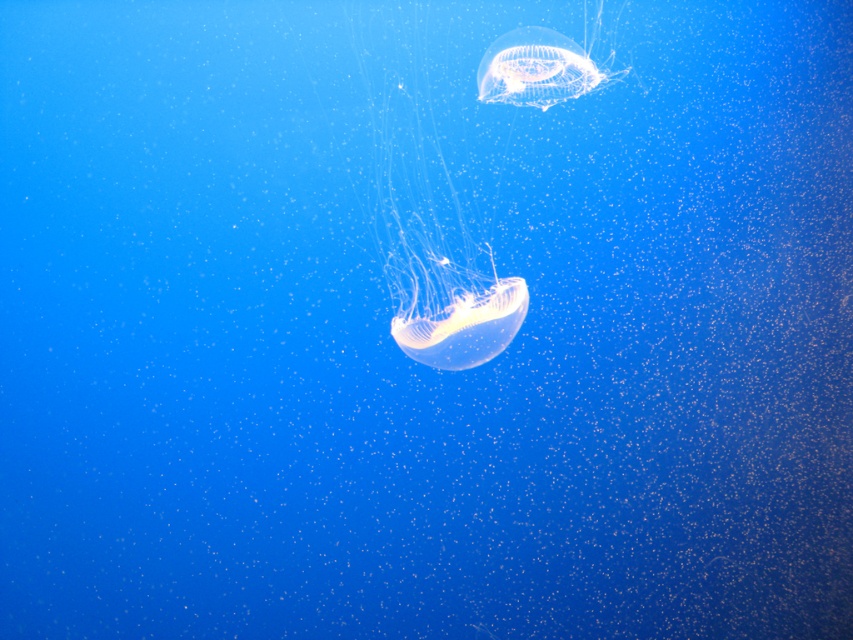
Question: Does translucent gelatinous at center have a larger size compared to transparent gelatinous at upper center?

Choices:
 (A) yes
 (B) no

Answer: (A)

Question: Can you confirm if translucent gelatinous at center is positioned to the left of transparent gelatinous at upper center?

Choices:
 (A) yes
 (B) no

Answer: (A)

Question: Observing the image, what is the correct spatial positioning of translucent gelatinous at center in reference to transparent gelatinous at upper center?

Choices:
 (A) left
 (B) right

Answer: (A)

Question: Which point is closer to the camera taking this photo?

Choices:
 (A) (392, 28)
 (B) (590, 67)

Answer: (B)

Question: Which object is farther from the camera taking this photo?

Choices:
 (A) translucent gelatinous at center
 (B) transparent gelatinous at upper center

Answer: (B)

Question: Among these points, which one is farthest from the camera?

Choices:
 (A) (392, 180)
 (B) (514, 80)

Answer: (A)